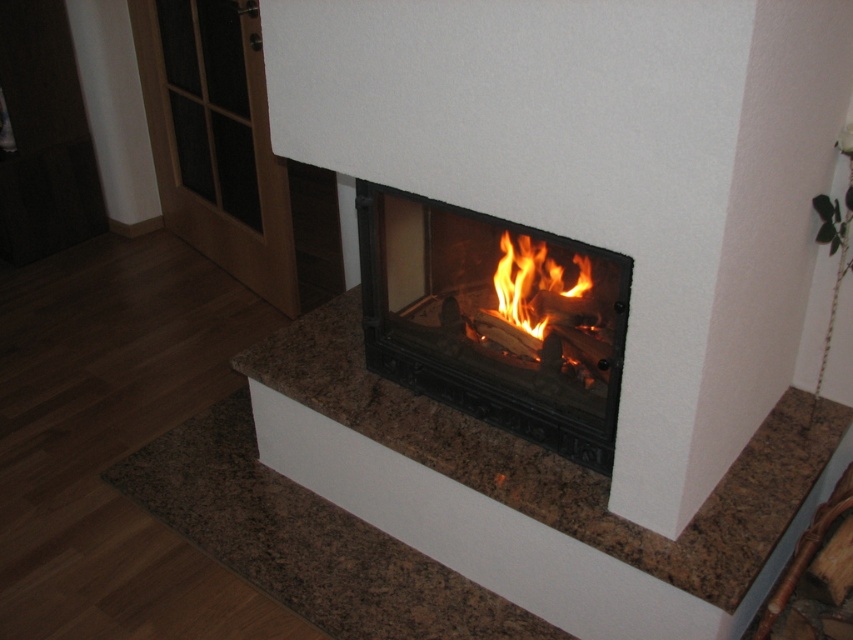
Question: Which point is farther to the camera?

Choices:
 (A) brown granite fireplace at center
 (B) flamewoodfire at center
 (C) black glass fireplace at center

Answer: (B)

Question: Does black glass fireplace at center have a smaller size compared to flamewoodfire at center?

Choices:
 (A) yes
 (B) no

Answer: (B)

Question: Which of these objects is positioned farthest from the brown granite fireplace at center?

Choices:
 (A) flamewoodfire at center
 (B) black glass fireplace at center

Answer: (A)

Question: Considering the relative positions of brown granite fireplace at center and flamewoodfire at center in the image provided, where is brown granite fireplace at center located with respect to flamewoodfire at center?

Choices:
 (A) right
 (B) left

Answer: (B)

Question: Can you confirm if brown granite fireplace at center is positioned to the right of flamewoodfire at center?

Choices:
 (A) no
 (B) yes

Answer: (A)

Question: Which point is farther to the camera?

Choices:
 (A) brown granite fireplace at center
 (B) black glass fireplace at center
 (C) flamewoodfire at center

Answer: (C)